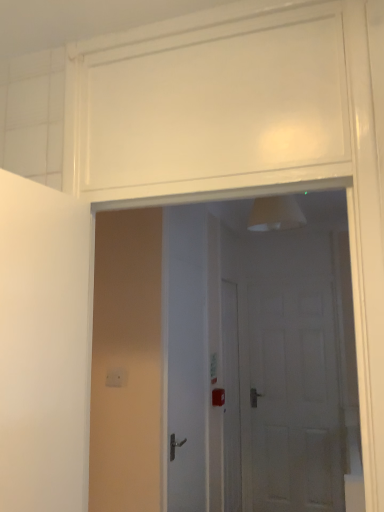
Question: Does white glossy door at center, the 3th door positioned from the right, have a lesser width compared to white glossy door at center, which is the second door in back-to-front order?

Choices:
 (A) yes
 (B) no

Answer: (B)

Question: From a real-world perspective, is white glossy door at center, the 3th door when ordered from back to front, positioned under white glossy door at center, which is the second door in back-to-front order, based on gravity?

Choices:
 (A) no
 (B) yes

Answer: (A)

Question: Is white glossy door at center, which appears as the 1th door when viewed from the left, smaller than white glossy door at center, marked as the 2th door in a front-to-back arrangement?

Choices:
 (A) no
 (B) yes

Answer: (A)

Question: Is white glossy door at center, the 3th door positioned from the right, bigger than white glossy door at center, marked as the 2th door in a front-to-back arrangement?

Choices:
 (A) yes
 (B) no

Answer: (A)

Question: Could white glossy door at center, which ranks as the 2th door in right-to-left order, be considered to be inside white glossy door at center, the first door viewed from the front?

Choices:
 (A) yes
 (B) no

Answer: (B)

Question: Looking at their shapes, would you say white glossy door at center, the 3th door positioned from the right, is wider or thinner than white matte door at center, which is counted as the 1th door, starting from the right?

Choices:
 (A) thin
 (B) wide

Answer: (B)

Question: From the image's perspective, is white glossy door at center, the 3th door when ordered from back to front, located above or below white matte door at center, which is counted as the 1th door, starting from the right?

Choices:
 (A) below
 (B) above

Answer: (B)

Question: Is white glossy door at center, the 3th door when ordered from back to front, in front of or behind white matte door at center, which ranks as the first door in back-to-front order, in the image?

Choices:
 (A) behind
 (B) front

Answer: (B)

Question: Is white glossy door at center, the 3th door positioned from the right, inside or outside of white matte door at center, which is counted as the 1th door, starting from the right?

Choices:
 (A) inside
 (B) outside

Answer: (B)

Question: Relative to white glossy door at center, which appears as the 1th door when viewed from the left, is white matte door at center, which is counted as the 3th door, starting from the front, in front or behind?

Choices:
 (A) front
 (B) behind

Answer: (B)

Question: From the image's perspective, relative to white glossy door at center, the first door viewed from the front, is white matte door at center, which ranks as the first door in back-to-front order, above or below?

Choices:
 (A) below
 (B) above

Answer: (A)

Question: Is white matte door at center, placed as the third door when sorted from left to right, taller or shorter than white glossy door at center, the first door viewed from the front?

Choices:
 (A) short
 (B) tall

Answer: (B)

Question: Do you think white matte door at center, which is counted as the 3th door, starting from the front, is within white glossy door at center, the 3th door positioned from the right, or outside of it?

Choices:
 (A) outside
 (B) inside

Answer: (A)

Question: From the image's perspective, is white matte door at center, placed as the third door when sorted from left to right, positioned above or below white glossy door at center, which ranks as the 2th door in right-to-left order?

Choices:
 (A) above
 (B) below

Answer: (B)

Question: Is point (334, 442) closer or farther from the camera than point (172, 268)?

Choices:
 (A) farther
 (B) closer

Answer: (A)